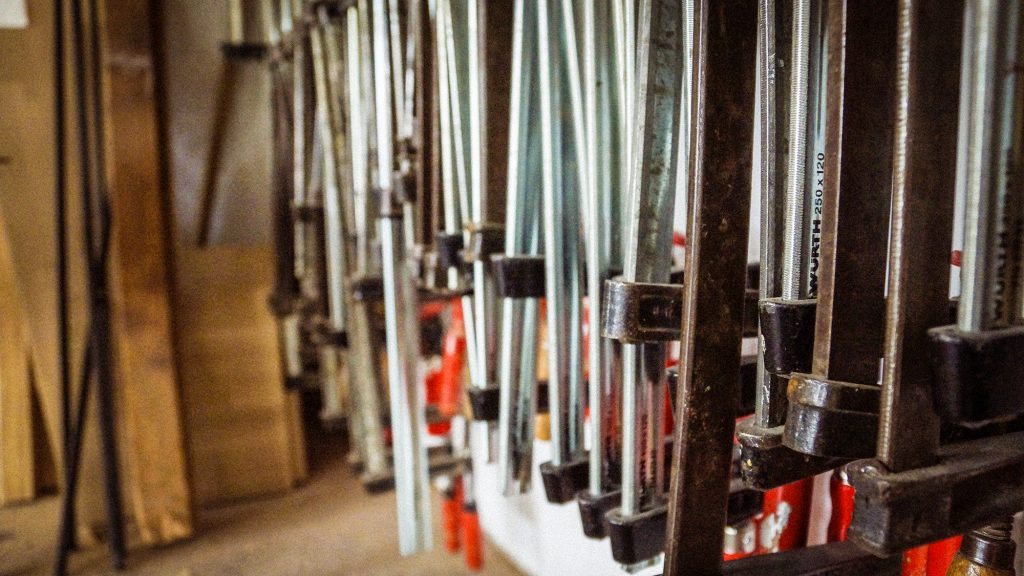
Locate an element on the screen. wall is located at coordinates (536, 541), (208, 26).